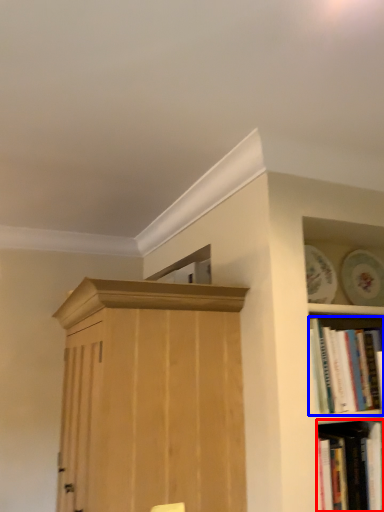
Question: Which point is closer to the camera, book (highlighted by a red box) or book (highlighted by a blue box)?

Choices:
 (A) book
 (B) book

Answer: (A)